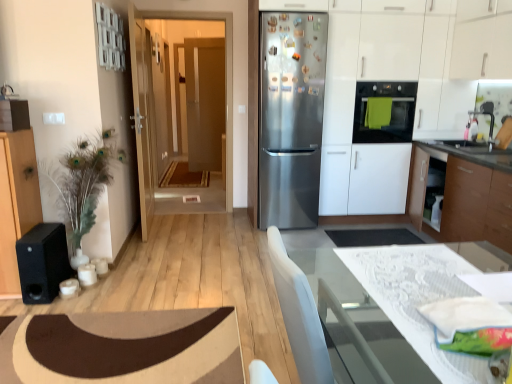
This screenshot has width=512, height=384. I want to click on vacant area that is in front of wooden door at center, marked as the first door in a front-to-back arrangement, so click(155, 242).